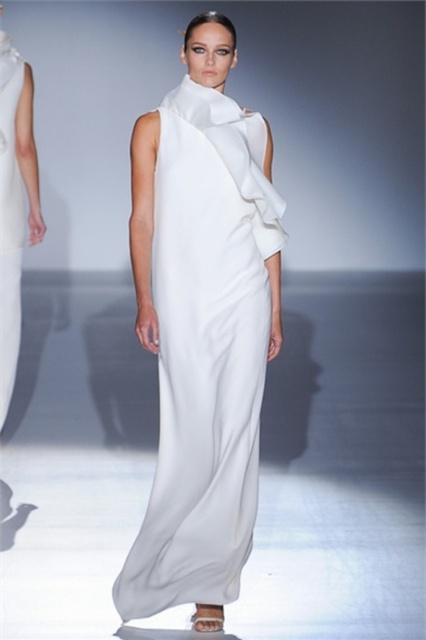
Question: Can you confirm if white satin dress at center is bigger than matte white dress at left?

Choices:
 (A) no
 (B) yes

Answer: (B)

Question: Is white satin dress at center thinner than matte white dress at left?

Choices:
 (A) yes
 (B) no

Answer: (B)

Question: Which object appears farthest from the camera in this image?

Choices:
 (A) matte white dress at left
 (B) white satin dress at center

Answer: (A)

Question: Which of the following is the farthest from the observer?

Choices:
 (A) matte white dress at left
 (B) white satin dress at center

Answer: (A)

Question: Does white satin dress at center have a lesser width compared to matte white dress at left?

Choices:
 (A) no
 (B) yes

Answer: (A)